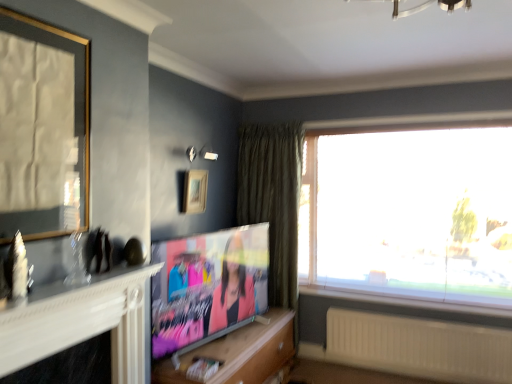
The height and width of the screenshot is (384, 512). In order to click on vacant area that lies between matte black tv at center and matte paper magazine at lower center in this screenshot , I will do `click(230, 355)`.